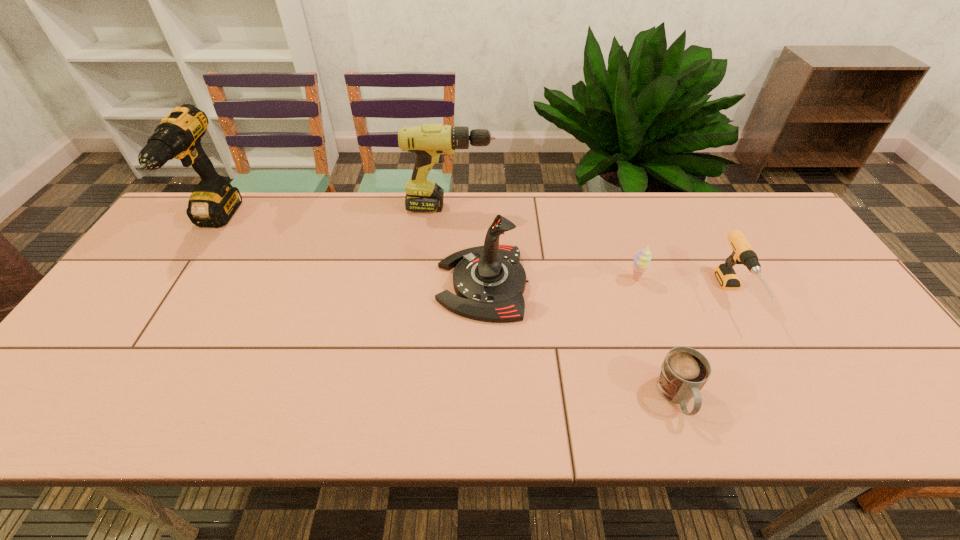
Where is `the leftmost drill`? the leftmost drill is located at coordinates (213, 202).

Image resolution: width=960 pixels, height=540 pixels. What are the coordinates of `the second drill from right to left` in the screenshot? It's located at (430, 142).

I want to click on the fourth shortest object, so click(x=489, y=281).

Where is `the rightmost drill`? Image resolution: width=960 pixels, height=540 pixels. the rightmost drill is located at coordinates (743, 253).

In order to click on the nearest drill in this screenshot , I will do `click(743, 253)`.

The image size is (960, 540). Identify the location of the second shortest object. (642, 257).

Identify the location of the nearest object. click(x=684, y=371).

Where is `mug`? This screenshot has width=960, height=540. mug is located at coordinates (684, 371).

Find the location of a particular element. This screenshot has height=540, width=960. vacant region located at the tip of the leftmost object is located at coordinates (176, 280).

Identify the location of vacant area situated on the handle side of the second drill from left to right. (513, 207).